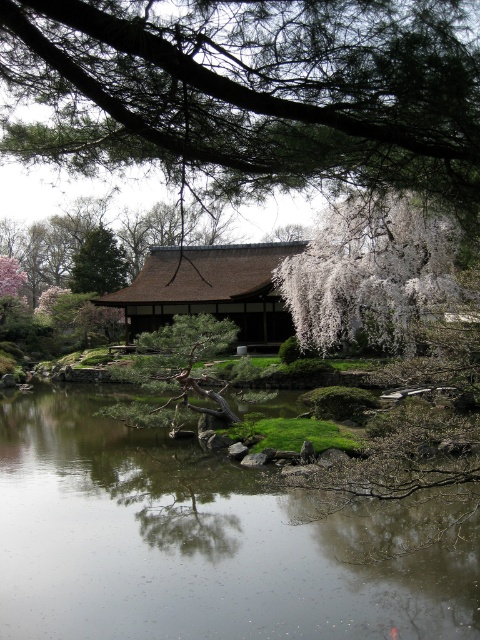
Question: Which of these objects is positioned closest to the transparent water at center?

Choices:
 (A) white blossoming tree at center
 (B) green textured pine branch at upper center

Answer: (B)

Question: Is white blossoming tree at center below green leafy tree at upper left?

Choices:
 (A) no
 (B) yes

Answer: (B)

Question: Does green textured pine branch at upper center appear on the right side of white blossoming tree at center?

Choices:
 (A) no
 (B) yes

Answer: (A)

Question: Is transparent water at center to the right of white blossoming tree at center from the viewer's perspective?

Choices:
 (A) no
 (B) yes

Answer: (A)

Question: Which is nearer to the green textured pine branch at upper center?

Choices:
 (A) white blossoming tree at center
 (B) transparent water at center
 (C) green leafy tree at upper left

Answer: (B)

Question: Which of these objects is positioned closest to the transparent water at center?

Choices:
 (A) white blossoming tree at center
 (B) green textured pine branch at upper center

Answer: (B)